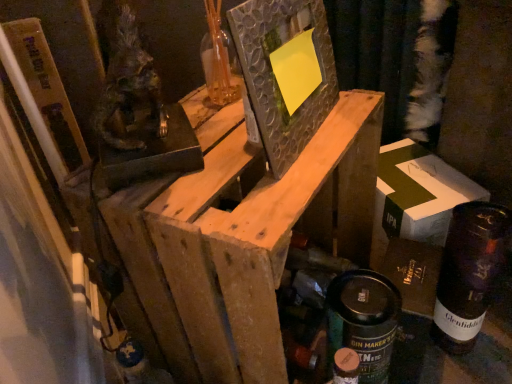
This screenshot has height=384, width=512. Identify the location of vacant area in front of textured glass picture frame at center. (281, 191).